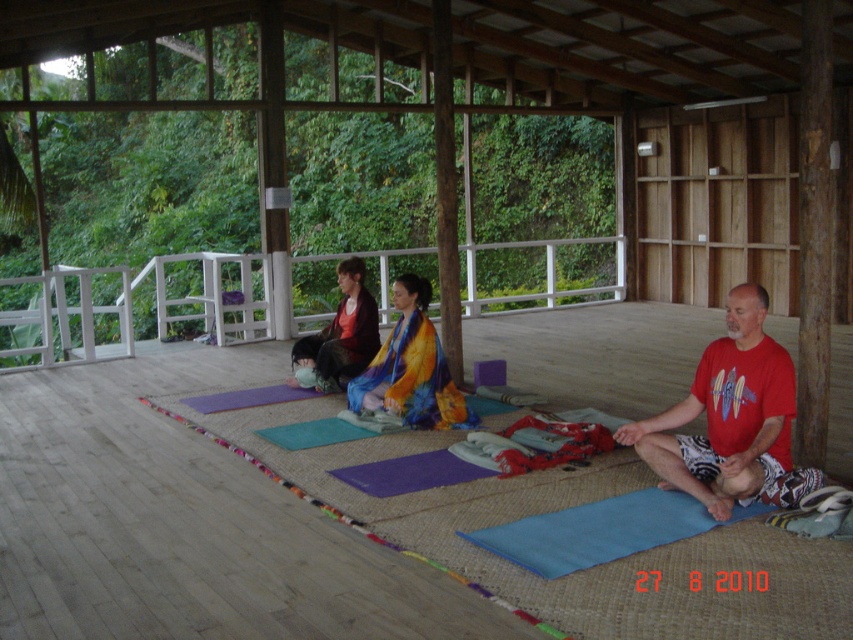
Identify the location of white wooden railing at upper center. (151, 301).

Does point (538, 248) lie behind point (718, 419)?

Yes, point (538, 248) is farther from viewer.

Between point (583, 237) and point (778, 417), which one is positioned in front?

Point (778, 417) is in front.

Find the location of `white wooden railing at upper center`. white wooden railing at upper center is located at coordinates (151, 301).

Does red cotton t-shirt at center lie in front of matte red sweater at center?

Yes, red cotton t-shirt at center is in front of matte red sweater at center.

Who is positioned more to the right, red cotton t-shirt at center or matte red sweater at center?

red cotton t-shirt at center

Is point (746, 292) more distant than point (305, 340)?

That is False.

Find the location of a particular element. The width and height of the screenshot is (853, 640). red cotton t-shirt at center is located at coordinates (726, 413).

Who is lower down, multicolored fabric at center or matte red sweater at center?

multicolored fabric at center

What do you see at coordinates (410, 369) in the screenshot? The image size is (853, 640). I see `multicolored fabric at center` at bounding box center [410, 369].

What are the coordinates of `multicolored fabric at center` in the screenshot? It's located at (410, 369).